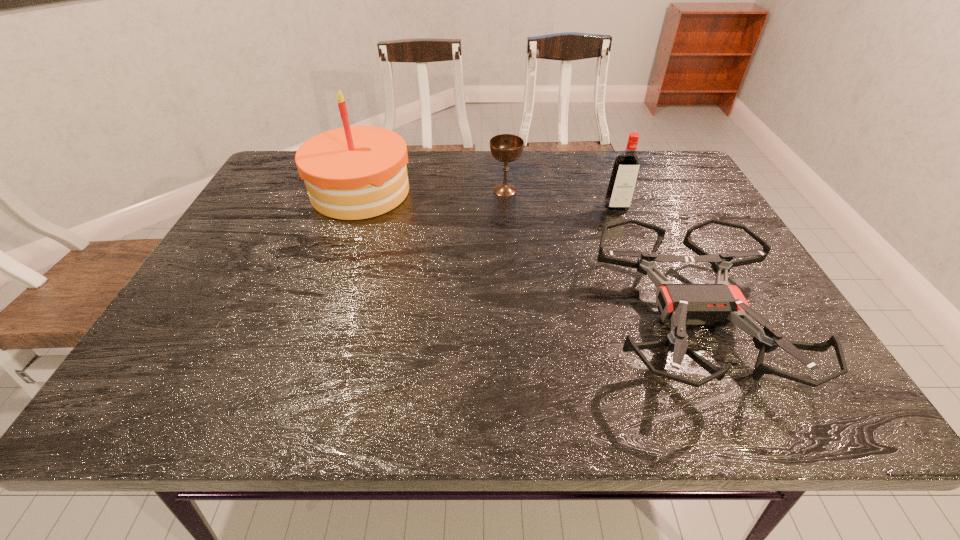
You are a GUI agent. You are given a task and a screenshot of the screen. Output one action in this format:
    pyautogui.click(x=<x>, y=<y>)
    Task: Click on the vacant region at the right edge of the desktop
    
    Given the screenshot: What is the action you would take?
    pyautogui.click(x=693, y=240)

Locate an element on the screen. free space at the far left corner is located at coordinates (278, 161).

I want to click on blank space at the near right corner, so click(x=818, y=396).

Image resolution: width=960 pixels, height=540 pixels. Find the location of `vacant space that's between the chalice and the birthday cake`. vacant space that's between the chalice and the birthday cake is located at coordinates (433, 191).

Where is `unoccupied area between the leftmost object and the vodka`? This screenshot has width=960, height=540. unoccupied area between the leftmost object and the vodka is located at coordinates (489, 199).

Identify the location of vacant space in between the tallest object and the shortest object. Image resolution: width=960 pixels, height=540 pixels. pyautogui.click(x=526, y=255).

You are a GUI agent. You are given a task and a screenshot of the screen. Output one action in this format:
    pyautogui.click(x=<x>, y=<y>)
    Task: Click on the free spot between the tallest object and the vodka
    The width and height of the screenshot is (960, 540).
    Given the screenshot: What is the action you would take?
    pyautogui.click(x=489, y=199)

The image size is (960, 540). I want to click on free space that is in between the third shortest object and the tallest object, so click(x=489, y=199).

Image resolution: width=960 pixels, height=540 pixels. I want to click on free space between the leftmost object and the second tallest object, so click(489, 199).

Locate an element on the screen. The image size is (960, 540). vacant space in between the nearest object and the birthday cake is located at coordinates (526, 255).